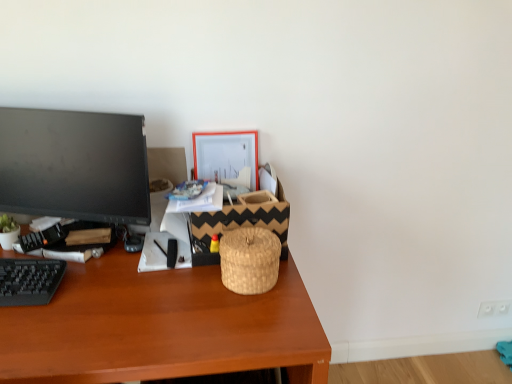
Question: From a real-world perspective, does black plastic keyboard at lower left stand above brown wooden desk at center?

Choices:
 (A) yes
 (B) no

Answer: (A)

Question: Is the position of black plastic keyboard at lower left less distant than that of brown wooden desk at center?

Choices:
 (A) no
 (B) yes

Answer: (A)

Question: Is black plastic keyboard at lower left not near brown wooden desk at center?

Choices:
 (A) no
 (B) yes

Answer: (A)

Question: Is black plastic keyboard at lower left facing away from brown wooden desk at center?

Choices:
 (A) yes
 (B) no

Answer: (B)

Question: Is black plastic keyboard at lower left taller than brown wooden desk at center?

Choices:
 (A) yes
 (B) no

Answer: (B)

Question: From the image's perspective, does black plastic keyboard at lower left appear higher than brown wooden desk at center?

Choices:
 (A) no
 (B) yes

Answer: (B)

Question: Is woven straw basket at center, which is the second basket in front-to-back order, inside woven natural basket at center, the second basket from the back?

Choices:
 (A) yes
 (B) no

Answer: (B)

Question: Is woven natural basket at center, the first basket in the front-to-back sequence, not inside woven straw basket at center, which is the second basket in front-to-back order?

Choices:
 (A) no
 (B) yes

Answer: (B)

Question: Are woven natural basket at center, the first basket in the front-to-back sequence, and woven straw basket at center, which is the second basket in front-to-back order, beside each other?

Choices:
 (A) yes
 (B) no

Answer: (A)

Question: Considering the relative positions of woven natural basket at center, the second basket from the back, and woven straw basket at center, which is the second basket in front-to-back order, in the image provided, is woven natural basket at center, the second basket from the back, to the left of woven straw basket at center, which is the second basket in front-to-back order, from the viewer's perspective?

Choices:
 (A) yes
 (B) no

Answer: (B)

Question: Can you confirm if woven natural basket at center, the first basket in the front-to-back sequence, is thinner than woven straw basket at center, which is the second basket in front-to-back order?

Choices:
 (A) yes
 (B) no

Answer: (A)

Question: Does woven natural basket at center, the second basket from the back, have a smaller size compared to woven straw basket at center, marked as the 1th basket in a back-to-front arrangement?

Choices:
 (A) yes
 (B) no

Answer: (A)

Question: From a real-world perspective, is woven straw basket at center, marked as the 1th basket in a back-to-front arrangement, beneath woven natural basket at center, the second basket from the back?

Choices:
 (A) no
 (B) yes

Answer: (A)